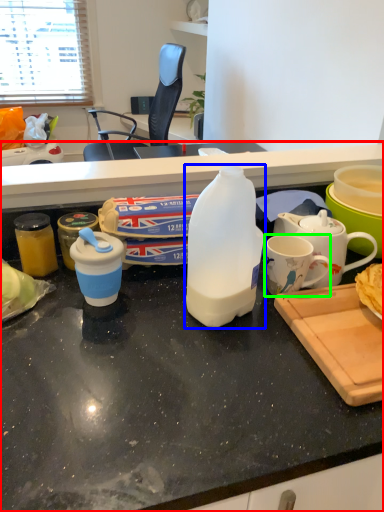
Question: Which object is the closest to the desk (highlighted by a red box)? Choose among these: bottle (highlighted by a blue box) or coffee cup (highlighted by a green box).

Choices:
 (A) bottle
 (B) coffee cup

Answer: (A)